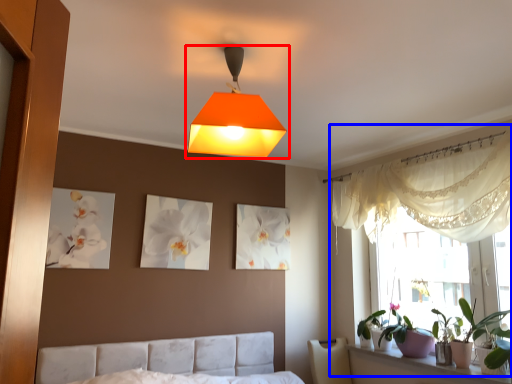
Question: Which object is further to the camera taking this photo, lamp (highlighted by a red box) or bay window (highlighted by a blue box)?

Choices:
 (A) lamp
 (B) bay window

Answer: (B)